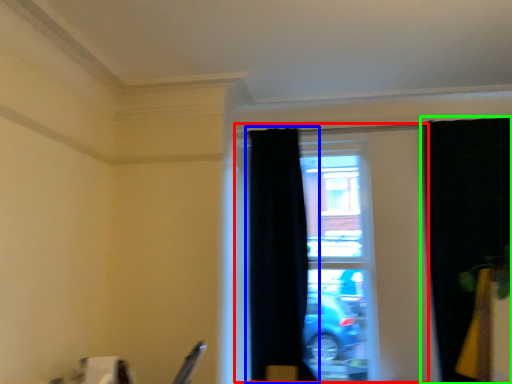
Question: Estimate the real-world distances between objects in this image. Which object is closer to window (highlighted by a red box), curtain (highlighted by a blue box) or curtain (highlighted by a green box)?

Choices:
 (A) curtain
 (B) curtain

Answer: (B)